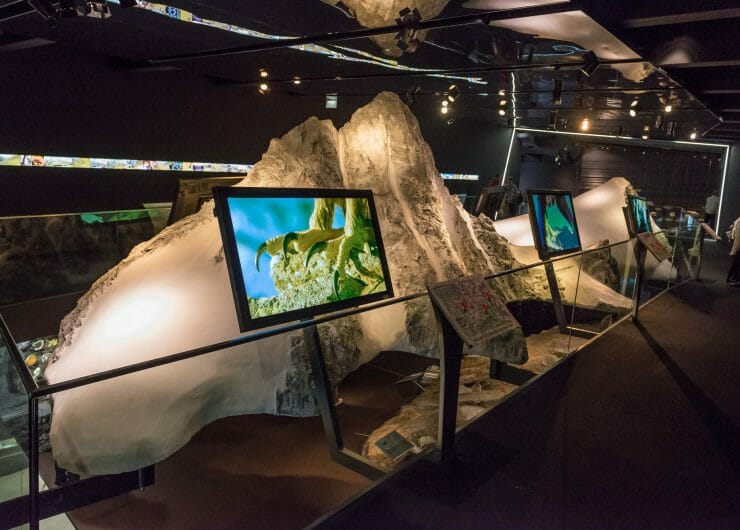
Where is `floor`? The image size is (740, 530). floor is located at coordinates (534, 438).